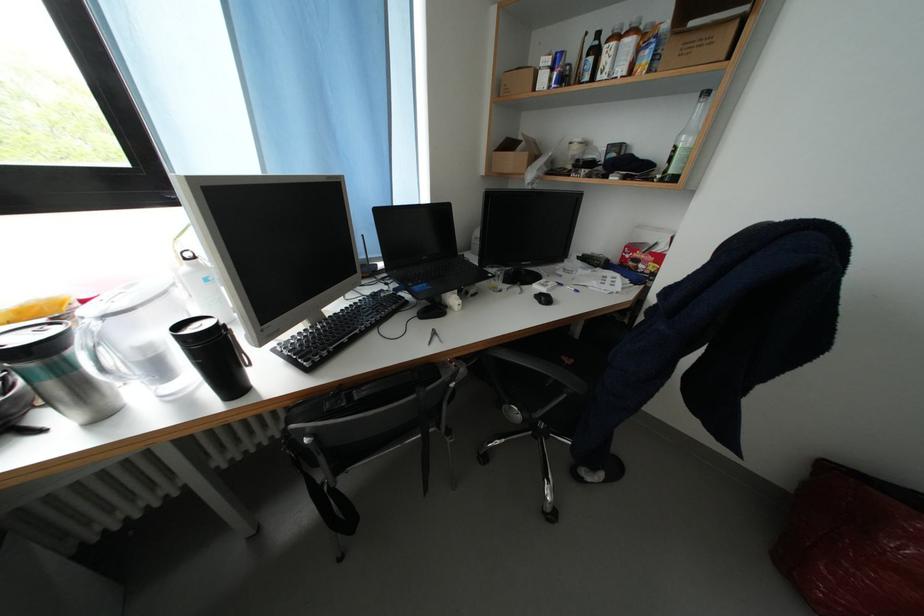
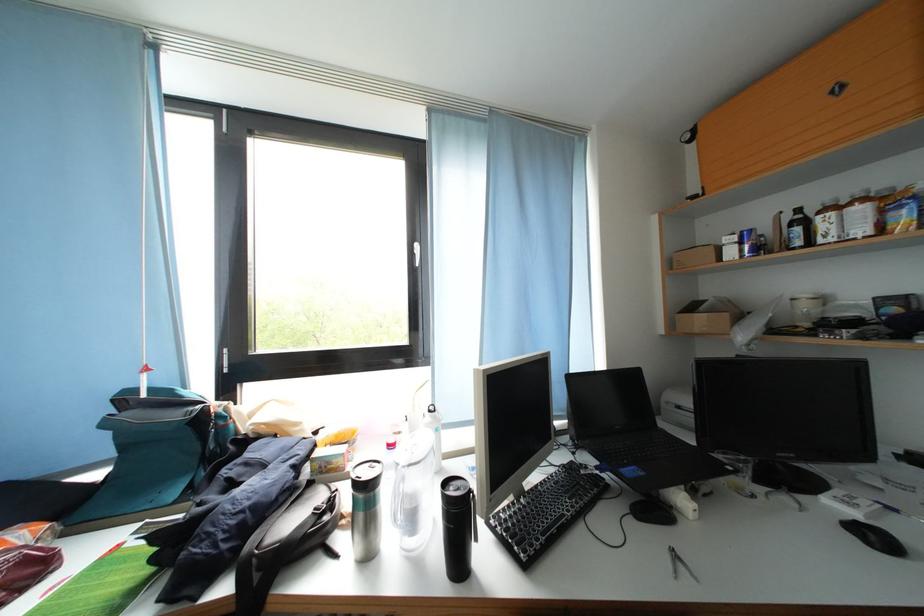
Find the pixel in the second image that matches (x=421, y=317) in the first image.

(630, 511)